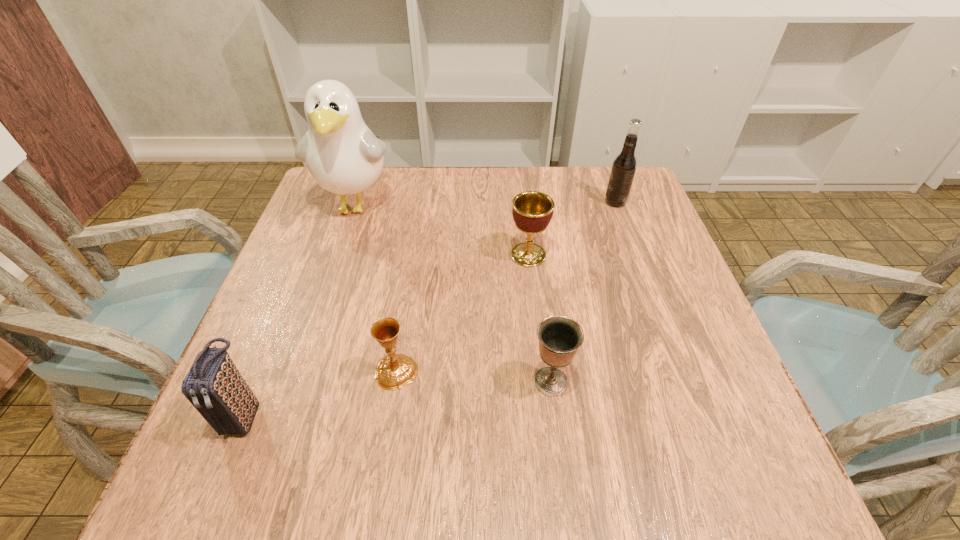
The height and width of the screenshot is (540, 960). Identify the location of free space that satisfies the following two spatial constraints: 1. on the label of the root beer; 2. with the zip open on the clutch bag. (694, 415).